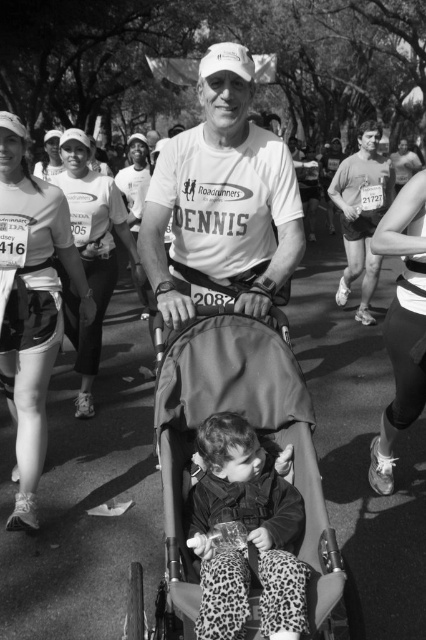
You are a photographer at the marathon event. You want to capture a photo of the leopard print pants at center without the matte white cap at center blocking it. Can you adjust your angle to do so?

The leopard print pants at center is behind the matte white cap at center, so adjusting your angle might allow you to capture the leopard print pants at center without the matte white cap at center blocking it by moving to a position where the cap is no longer in front.

You are a photographer trying to capture a closeup of the leopard print pants at center while focusing on the dark gray fabric stroller at center. Which object should you adjust your camera focus to prioritize for a clear image?

The dark gray fabric stroller at center is further to the viewer than leopard print pants at center, so you should prioritize focusing on the dark gray fabric stroller at center to ensure it appears sharp in the photo.

You are a photographer at the marathon event. You want to capture a photo of the dark gray fabric stroller at center. Where should you aim your camera to ensure it captures the stroller in the frame?

You should aim your camera at point 0.700 on the x axis and point 0.622 on the y axis to capture the dark gray fabric stroller at center.